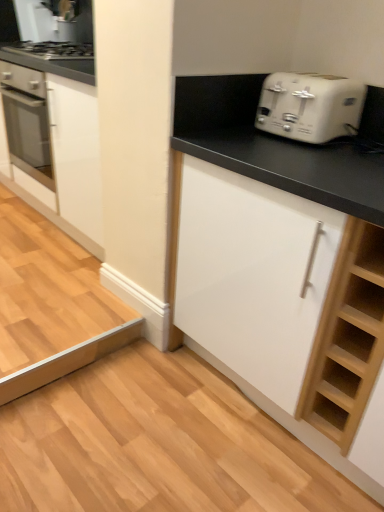
I want to click on free space in front of white plastic toaster at upper right, so click(x=320, y=156).